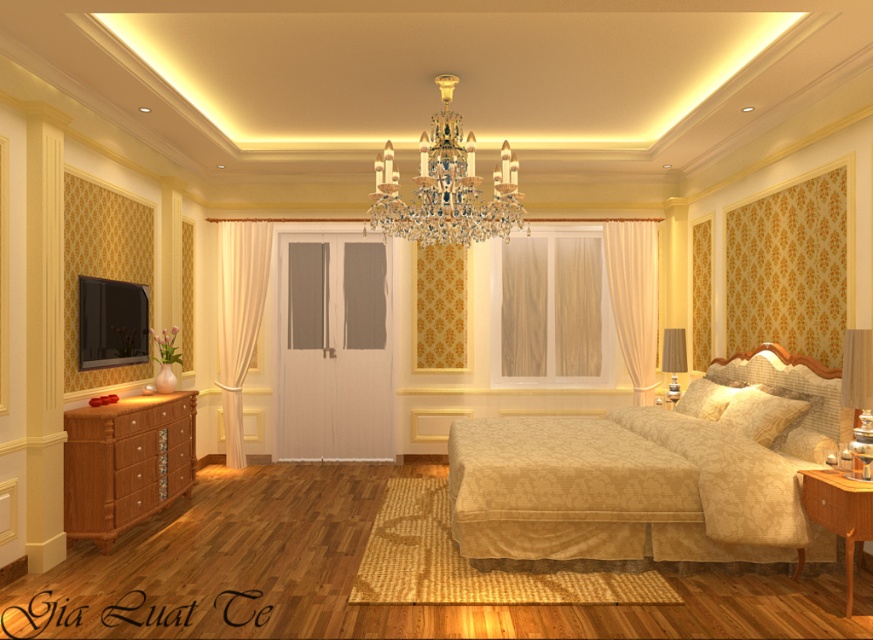
Is point (650, 224) positioned after point (863, 333)?

Yes.

Is point (644, 371) in front of point (850, 372)?

No, it is behind (850, 372).

At what (x,y) coordinates should I click in order to perform the action: click on white sheer curtain at right. Please return your answer as a coordinate pair (x, y). The height and width of the screenshot is (640, 873). Looking at the image, I should click on pos(634,298).

Does point (698, 502) come in front of point (700, 412)?

Yes.

Does point (540, 465) come farther from viewer compared to point (717, 390)?

That is False.

Locate an element on the screen. beige fabric bed at center is located at coordinates (643, 481).

Where is `beige fabric bed at center`? This screenshot has width=873, height=640. beige fabric bed at center is located at coordinates (643, 481).

Can you confirm if beige fabric bed at center is thinner than white sheer curtain at center?

Incorrect, beige fabric bed at center's width is not less than white sheer curtain at center's.

This screenshot has height=640, width=873. What are the coordinates of `beige fabric bed at center` in the screenshot? It's located at (643, 481).